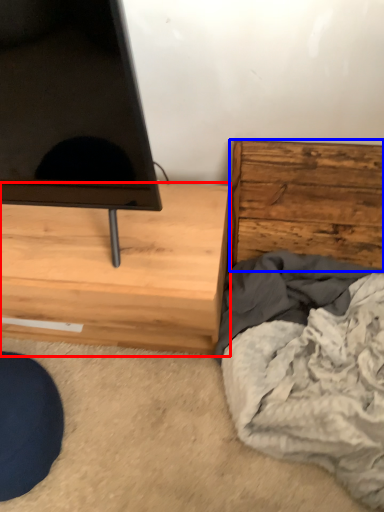
Question: Which object appears farthest to the camera in this image, chest of drawers (highlighted by a red box) or chest of drawers (highlighted by a blue box)?

Choices:
 (A) chest of drawers
 (B) chest of drawers

Answer: (B)